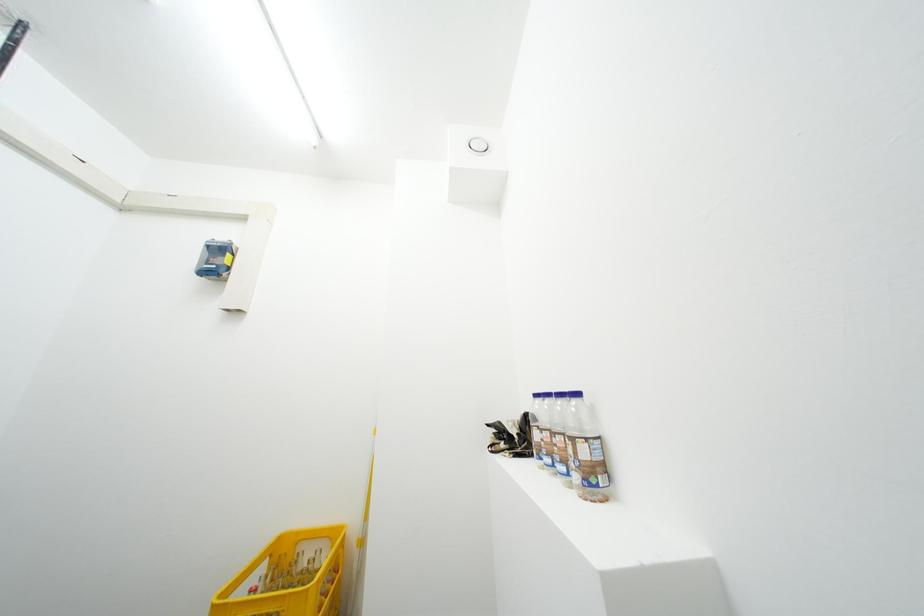
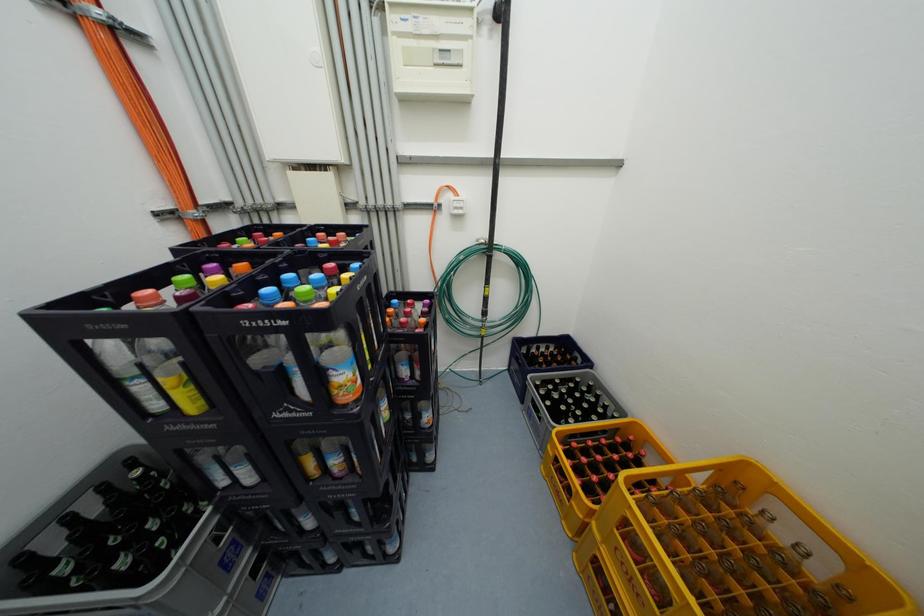
Based on the continuous images, in which direction is the camera rotating?

The camera rotated toward left-down.